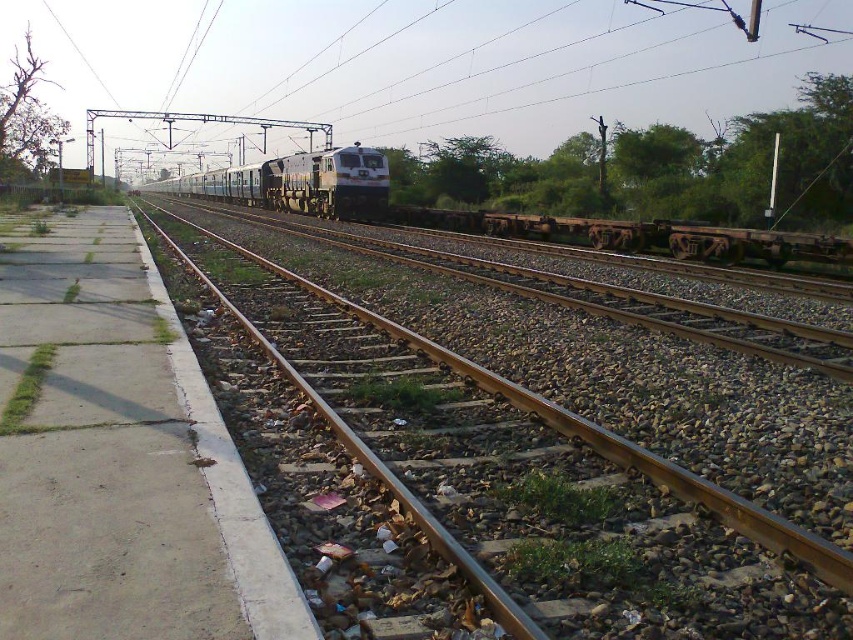
Who is shorter, brown gravel track at center or metallic wire at upper center?

With less height is brown gravel track at center.

Is brown gravel track at center smaller than metallic wire at upper center?

Yes.

This screenshot has height=640, width=853. What do you see at coordinates (534, 477) in the screenshot?
I see `brown gravel track at center` at bounding box center [534, 477].

Locate an element on the screen. Image resolution: width=853 pixels, height=640 pixels. brown gravel track at center is located at coordinates (534, 477).

Who is positioned more to the left, brown gravel track at center or metallic blue train at center?

metallic blue train at center

Who is lower down, brown gravel track at center or metallic blue train at center?

Result: brown gravel track at center is lower down.

Who is more forward, (695, 611) or (357, 177)?

Point (695, 611)

This screenshot has width=853, height=640. I want to click on brown gravel track at center, so click(x=534, y=477).

Can you confirm if metallic wire at upper center is shorter than rusty metal flatbed at center?

In fact, metallic wire at upper center may be taller than rusty metal flatbed at center.

Does point (527, 0) come closer to viewer compared to point (602, 221)?

No, it is not.

Locate an element on the screen. metallic wire at upper center is located at coordinates (428, 61).